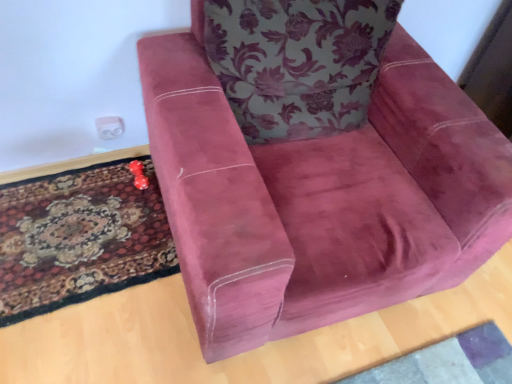
Find the location of a particular element. vacant space to the left of rubberized red dice at lower left is located at coordinates (98, 176).